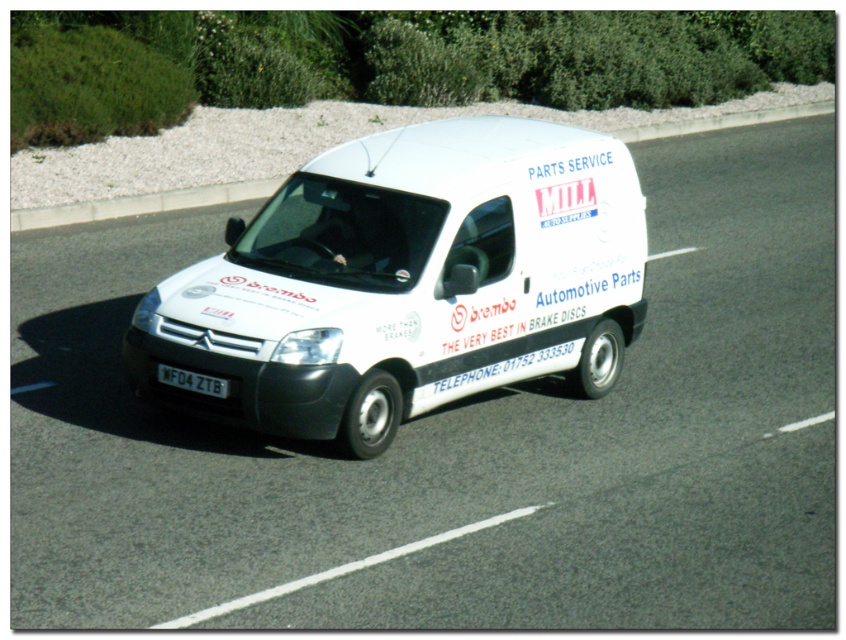
How much distance is there between white concrete curb at upper center and black plastic license plate at bottom center?

white concrete curb at upper center and black plastic license plate at bottom center are 8.04 meters apart from each other.

From the picture: Can you confirm if white concrete curb at upper center is positioned to the left of black plastic license plate at bottom center?

Incorrect, white concrete curb at upper center is not on the left side of black plastic license plate at bottom center.

What do you see at coordinates (141, 204) in the screenshot? I see `white concrete curb at upper center` at bounding box center [141, 204].

Identify the location of white concrete curb at upper center. (141, 204).

Which of these two, white matte van at center or black plastic license plate at bottom center, stands taller?

With more height is white matte van at center.

Find the location of a particular element. The width and height of the screenshot is (846, 640). white matte van at center is located at coordinates (408, 282).

You are a GUI agent. You are given a task and a screenshot of the screen. Output one action in this format:
    pyautogui.click(x=<x>, y=<y>)
    Task: Click on the white matte van at center
    
    Given the screenshot: What is the action you would take?
    pyautogui.click(x=408, y=282)

Is point (166, 291) more distant than point (26, 212)?

No, (166, 291) is closer to viewer.

In the scene shown: Between white matte van at center and white concrete curb at upper center, which one appears on the left side from the viewer's perspective?

white matte van at center is more to the left.

Between point (426, 230) and point (740, 113), which one is positioned behind?

The point (740, 113) is behind.

Locate an element on the screen. The width and height of the screenshot is (846, 640). white matte van at center is located at coordinates (408, 282).